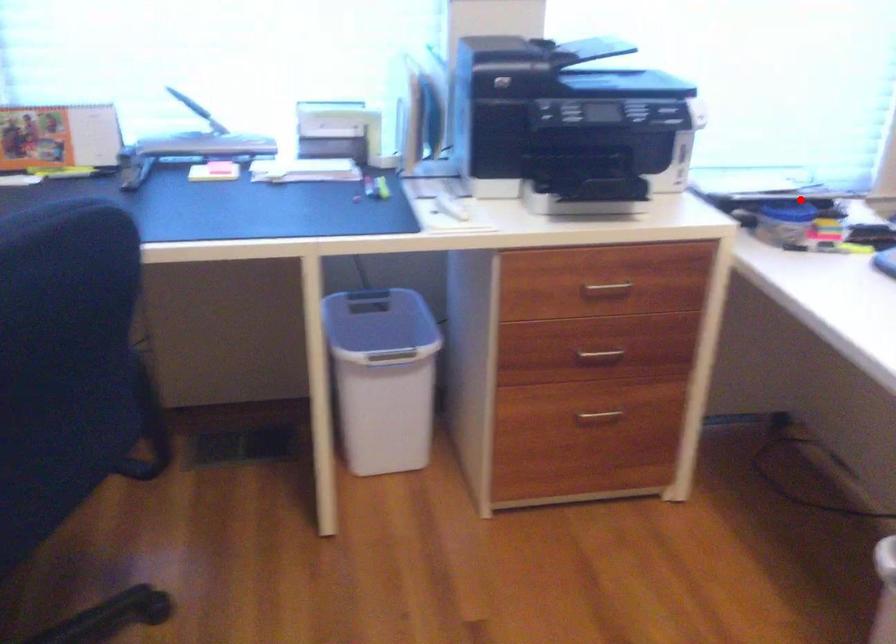
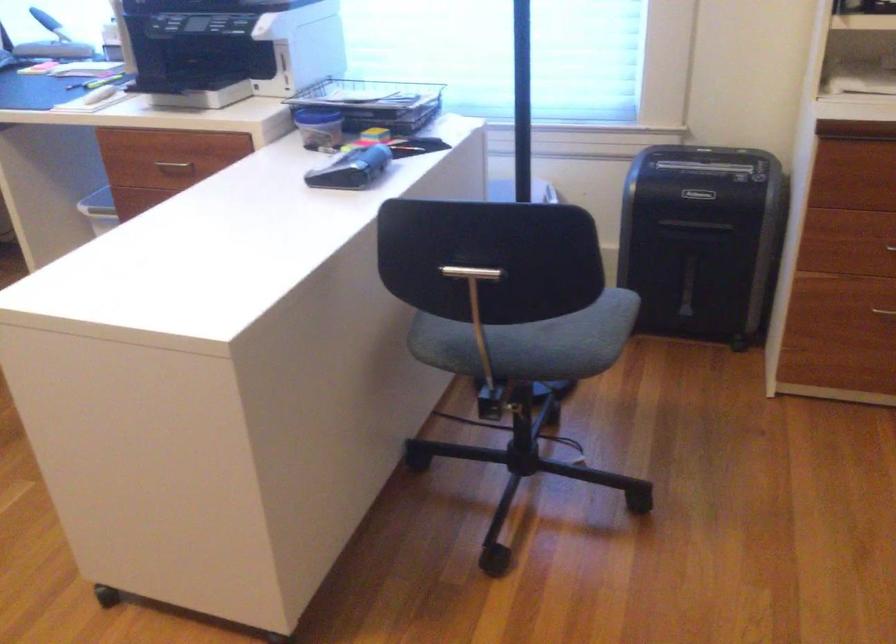
Question: I am providing you with two images of the same scene from different viewpoints. Image1 has a red point marked. In image2, the corresponding 3D location appears at what relative position? Reply with the corresponding letter.

Choices:
 (A) Closer
 (B) Farther

Answer: (B)